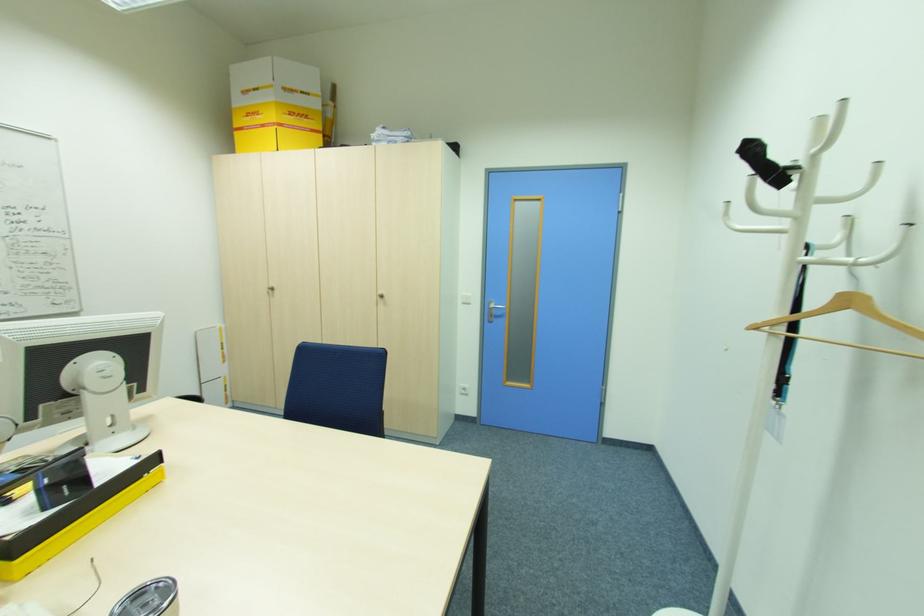
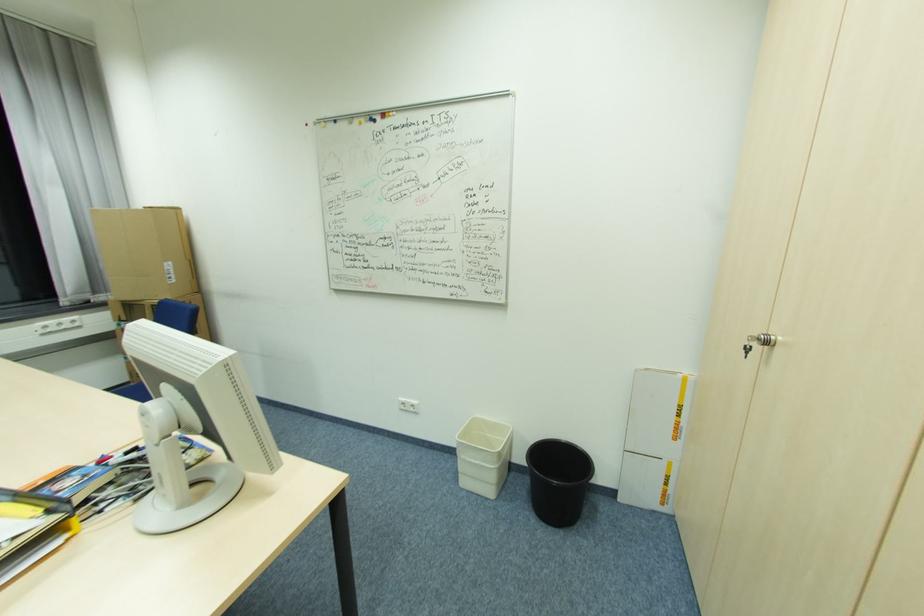
In the second image, find the point that corresponds to [274,290] in the first image.

(772, 344)